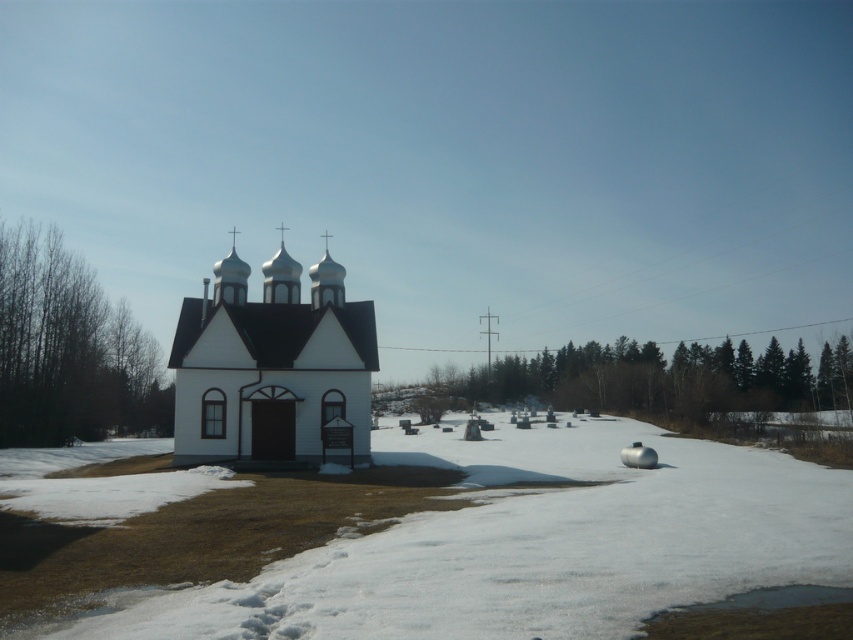
Does white metallic spire at center come behind white metallic dome at center?

No, it is in front of white metallic dome at center.

Who is more distant from viewer, (325, 241) or (219, 275)?

Point (325, 241)

Measure the distance between white metallic spire at center and camera.

white metallic spire at center and camera are 129.89 feet apart from each other.

What are the coordinates of `white metallic spire at center` in the screenshot? It's located at click(x=326, y=280).

Can you confirm if white powdery snow at lower center is positioned above white metallic dome at center?

No.

Which is below, white powdery snow at lower center or white metallic dome at center?

white powdery snow at lower center

Where is `white powdery snow at lower center`? This screenshot has width=853, height=640. white powdery snow at lower center is located at coordinates (532, 545).

Identify the location of white powdery snow at lower center. (532, 545).

Can you confirm if white matte church at center is smaller than white metallic spire at center?

Yes, white matte church at center is smaller than white metallic spire at center.

Based on the photo, is white matte church at center above white metallic spire at center?

No.

Locate an element on the screen. The image size is (853, 640). white matte church at center is located at coordinates (273, 368).